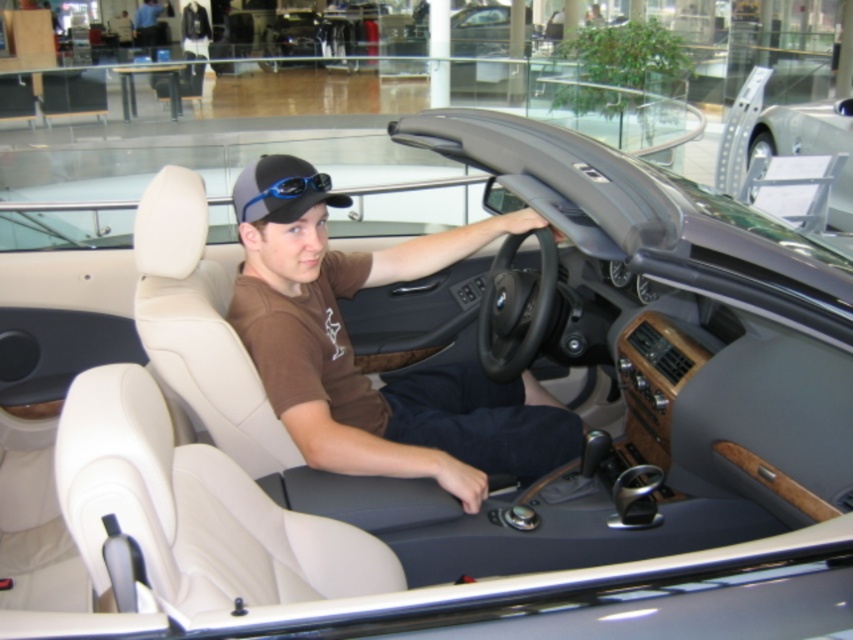
Which is more to the left, brown cotton t-shirt at center or silver metallic car at upper right?

brown cotton t-shirt at center is more to the left.

Which is in front, point (515, 392) or point (746, 92)?

Point (515, 392) is in front.

Is point (276, 365) behind point (798, 112)?

No, it is in front of (798, 112).

At what (x,y) coordinates should I click in order to perform the action: click on brown cotton t-shirt at center. Please return your answer as a coordinate pair (x, y). The width and height of the screenshot is (853, 640). Looking at the image, I should click on 352,353.

Can you confirm if brown cotton t-shirt at center is taller than black fabric baseball cap at center?

Indeed, brown cotton t-shirt at center has a greater height compared to black fabric baseball cap at center.

Between point (450, 412) and point (279, 163), which one is positioned in front?

Point (279, 163) is more forward.

What do you see at coordinates (352, 353) in the screenshot? Image resolution: width=853 pixels, height=640 pixels. I see `brown cotton t-shirt at center` at bounding box center [352, 353].

Locate an element on the screen. brown cotton t-shirt at center is located at coordinates pos(352,353).

Looking at this image, is black fabric baseball cap at center shorter than silver metallic car at upper right?

Yes.

Between black fabric baseball cap at center and silver metallic car at upper right, which one is positioned lower?

black fabric baseball cap at center

Identify the location of black fabric baseball cap at center. (281, 189).

Where is `black fabric baseball cap at center`? This screenshot has height=640, width=853. black fabric baseball cap at center is located at coordinates (281, 189).